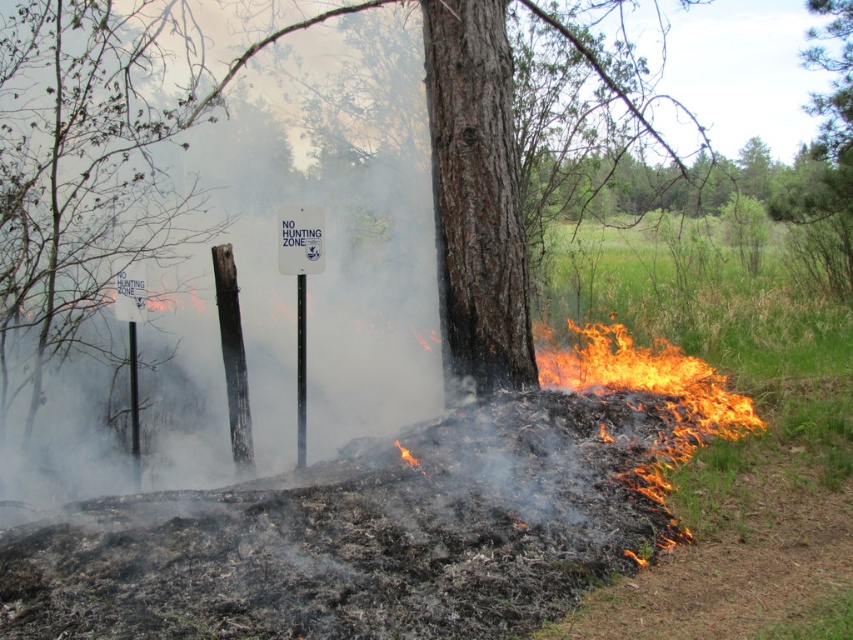
You are a firefighter assessing the fire perimeter. You notice the flame at lower right and the smooth wooden pole at center. How far apart are these two objects in feet?

The distance between the flame at lower right and the smooth wooden pole at center is 16.27 feet.

You need to choose between the black plastic pole at center and the smooth wooden pole at center to attach a warning flag. Which pole is more suitable based on its thickness?

The smooth wooden pole at center is thicker than the black plastic pole at center, making it more suitable for attaching a warning flag as it can provide better support.